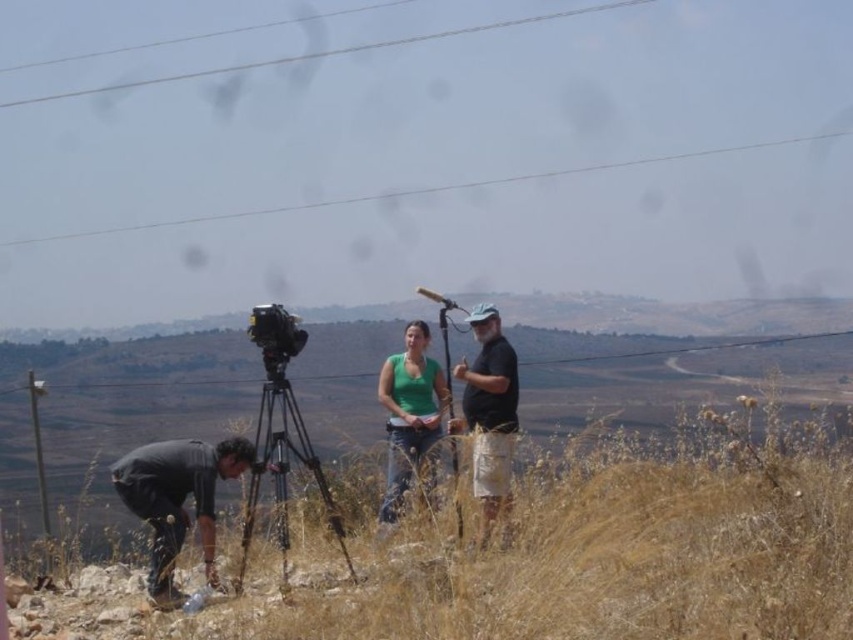
Who is higher up, dry grass at lower center or metallic silver video camera at center?

metallic silver video camera at center

Is dry grass at lower center positioned before metallic silver video camera at center?

No.

Between point (387, 620) and point (251, 340), which one is positioned in front?

Point (387, 620) is in front.

At what (x,y) coordinates should I click in order to perform the action: click on dry grass at lower center. Please return your answer as a coordinate pair (x, y). This screenshot has width=853, height=640. Looking at the image, I should click on (547, 550).

Does black matte tripod at lower left lie behind metallic silver video camera at center?

No.

Which is more to the right, black matte tripod at lower left or metallic silver video camera at center?

black matte tripod at lower left

Identify the location of black matte tripod at lower left. This screenshot has height=640, width=853. (282, 468).

Does dry grass at lower center lie behind clear wire at upper center?

No, it is not.

Is dry grass at lower center to the right of clear wire at upper center from the viewer's perspective?

Incorrect, dry grass at lower center is not on the right side of clear wire at upper center.

Where is `dry grass at lower center`? This screenshot has width=853, height=640. dry grass at lower center is located at coordinates (547, 550).

Find the location of `dry grass at lower center`. dry grass at lower center is located at coordinates (547, 550).